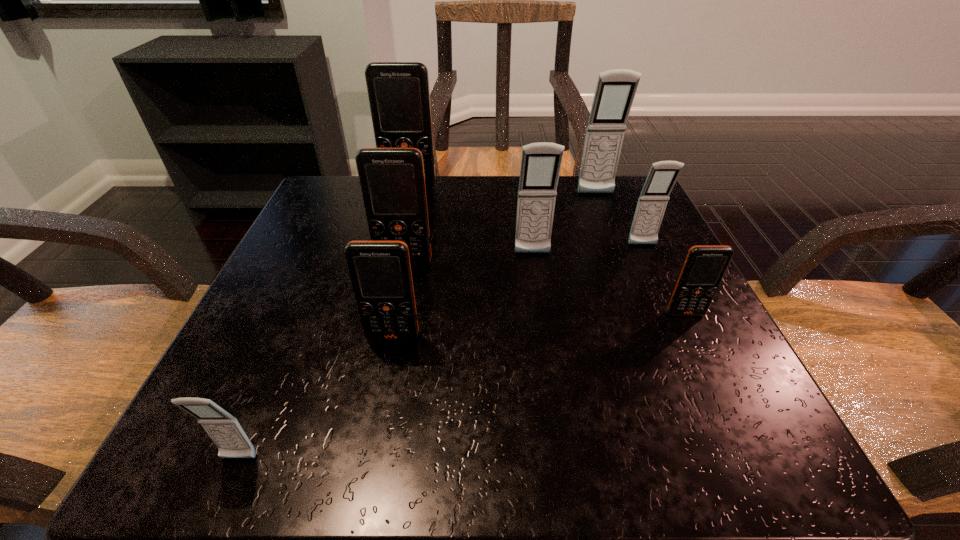
Locate an element on the screen. object identified as the seventh closest to the leftmost cellular telephone is located at coordinates (615, 91).

Identify which cellular telephone is the fourth nearest to the farthest gray cellular telephone. Please provide its 2D coordinates. Your answer should be formatted as a tuple, i.e. [(x, y)], where the tuple contains the x and y coordinates of a point satisfying the conditions above.

[(704, 267)]

Locate an element on the screen. cellular telephone that is the third closest one to the fifth farthest object is located at coordinates (399, 97).

At what (x,y) coordinates should I click in order to perform the action: click on orange cellular telephone identified as the third closest to the leftmost object. Please return your answer as a coordinate pair (x, y). Image resolution: width=960 pixels, height=540 pixels. Looking at the image, I should click on (704, 267).

Identify which orange cellular telephone is located as the nearest to the third nearest gray cellular telephone. Please provide its 2D coordinates. Your answer should be formatted as a tuple, i.e. [(x, y)], where the tuple contains the x and y coordinates of a point satisfying the conditions above.

[(704, 267)]

Locate which gray cellular telephone is the closest to the fifth farthest cellular telephone. Please provide its 2D coordinates. Your answer should be formatted as a tuple, i.e. [(x, y)], where the tuple contains the x and y coordinates of a point satisfying the conditions above.

[(541, 162)]

Identify which gray cellular telephone is located as the nearest to the farthest orange cellular telephone. Please provide its 2D coordinates. Your answer should be formatted as a tuple, i.e. [(x, y)], where the tuple contains the x and y coordinates of a point satisfying the conditions above.

[(541, 162)]